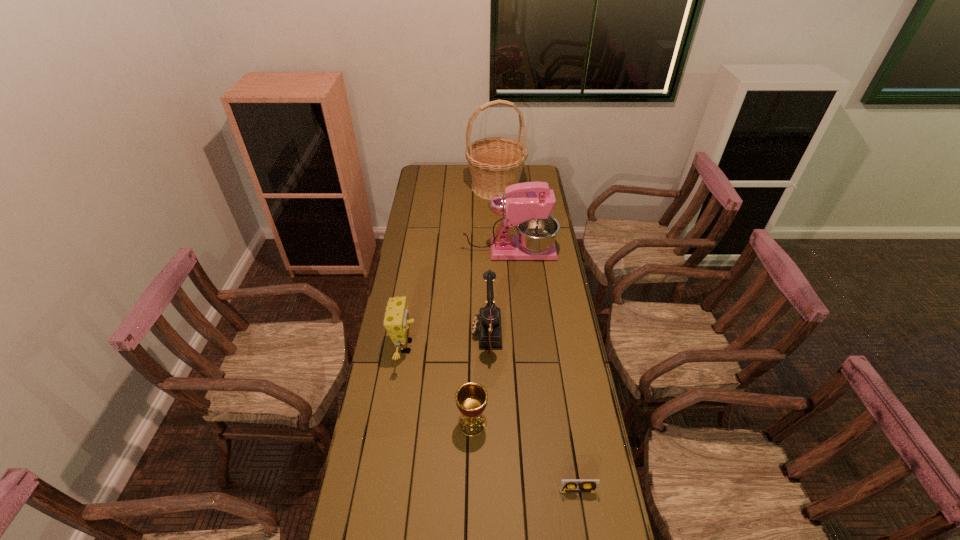
You are a GUI agent. You are given a task and a screenshot of the screen. Output one action in this format:
    pyautogui.click(x=<x>, y=<y>)
    Task: Click on the shortest object
    This screenshot has height=540, width=960.
    Given the screenshot: What is the action you would take?
    pyautogui.click(x=567, y=485)

Identify the location of blank area located on the front of the tallest object. Image resolution: width=960 pixels, height=540 pixels. (498, 241).

You are a GUI agent. You are given a task and a screenshot of the screen. Output one action in this format:
    pyautogui.click(x=<x>, y=<y>)
    Task: Click on the free space located on the dial of the telephone
    
    Given the screenshot: What is the action you would take?
    pyautogui.click(x=441, y=336)

Where is `vacant space located on the dial of the telephone`? The height and width of the screenshot is (540, 960). vacant space located on the dial of the telephone is located at coordinates (444, 336).

At what (x,y) coordinates should I click in order to perform the action: click on vacant point located on the dial of the telephone. Please return your answer as a coordinate pair (x, y). Looking at the image, I should click on (416, 336).

Find the location of a particular element. free space located 0.120m on the face of the fourth tallest object is located at coordinates (449, 347).

Where is `vacant space located 0.400m on the back of the chalice`? vacant space located 0.400m on the back of the chalice is located at coordinates (473, 321).

Identify the location of blank area located 0.090m at the front of the videotape with visible reels. (583, 526).

You are a GUI agent. You are given a task and a screenshot of the screen. Output one action in this format:
    pyautogui.click(x=<x>, y=<y>)
    Task: Click on the object that is at the far edge
    
    Given the screenshot: What is the action you would take?
    pyautogui.click(x=495, y=163)

Where is `object that is at the left edge`? Image resolution: width=960 pixels, height=540 pixels. object that is at the left edge is located at coordinates (396, 321).